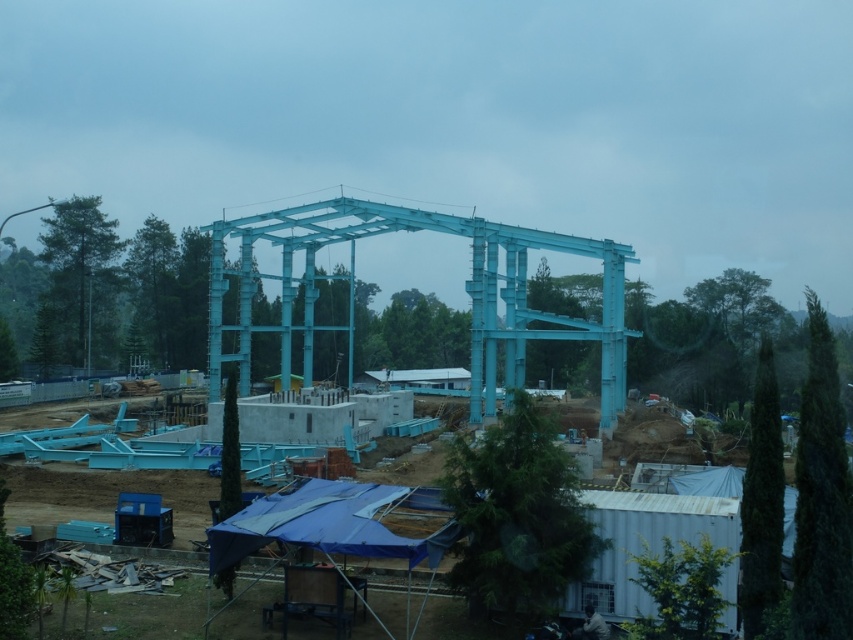
You are standing at the construction site and want to determine the relative positions of two points marked on the steel framework. The points are labeled as point (618, 264) and point (380, 228). Which point is nearer to you?

Answer: Point (618, 264) is closer to the viewer than point (380, 228).

You are a construction worker standing at the point marked by the coordinates point (x=465, y=291). Based on the scene, what object are you standing near?

The point (x=465, y=291) marks the metallic blue steel structure at center, so you are standing near the metallic blue steel structure at center.

You are a construction worker who needs to move a 1.5 meter long steel beam from one end to the other between the metallic blue steel structure at center and the light blue metallic structure at center. Can you fit the steel beam between them without bending it?

The distance between the metallic blue steel structure at center and the light blue metallic structure at center is 1.36 meters. Since the steel beam is 1.5 meters long, it is longer than the gap between them. Therefore, the steel beam cannot fit between them without bending.